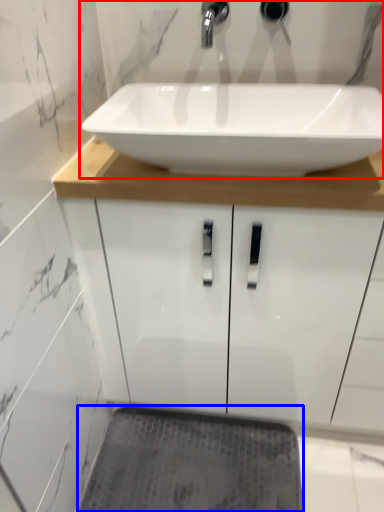
Question: Which object appears closest to the camera in this image, sink (highlighted by a red box) or bath mat (highlighted by a blue box)?

Choices:
 (A) sink
 (B) bath mat

Answer: (A)